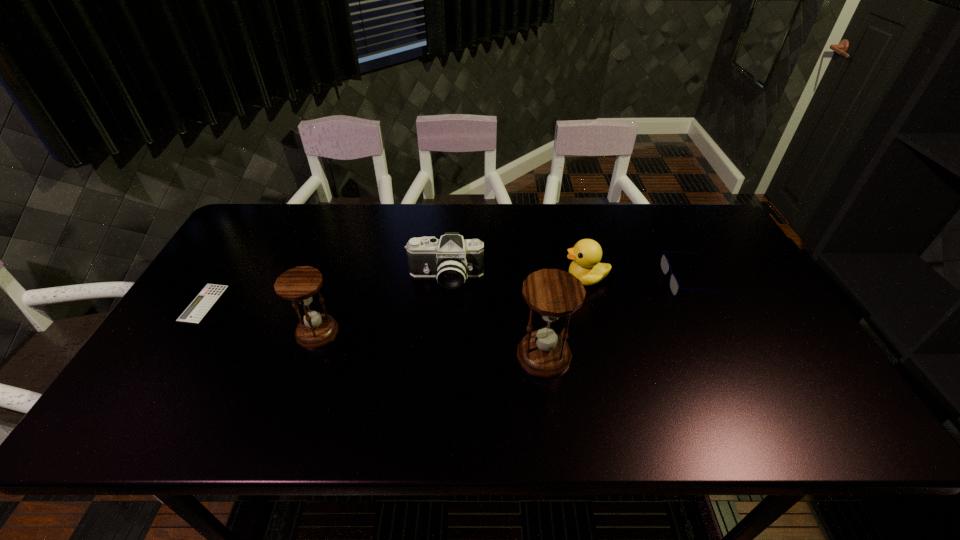
This screenshot has height=540, width=960. What are the coordinates of `the fourth closest object relative to the leftmost object` in the screenshot? It's located at point(587,253).

Where is `free space that satisfies the following two spatial constraints: 1. on the back side of the second tallest object; 2. on the right side of the fourth object from right to left`? free space that satisfies the following two spatial constraints: 1. on the back side of the second tallest object; 2. on the right side of the fourth object from right to left is located at coordinates point(336,278).

At what (x,y) coordinates should I click in order to perform the action: click on vacant space that satisfies the following two spatial constraints: 1. on the front-facing side of the spectacles; 2. on the front side of the right hourglass. Please return your answer as a coordinate pair (x, y). This screenshot has width=960, height=540. Looking at the image, I should click on (729, 355).

Find the location of a particular element. The image size is (960, 540). free spot that satisfies the following two spatial constraints: 1. on the face of the fifth object from left to right; 2. on the front side of the fifth shortest object is located at coordinates 599,332.